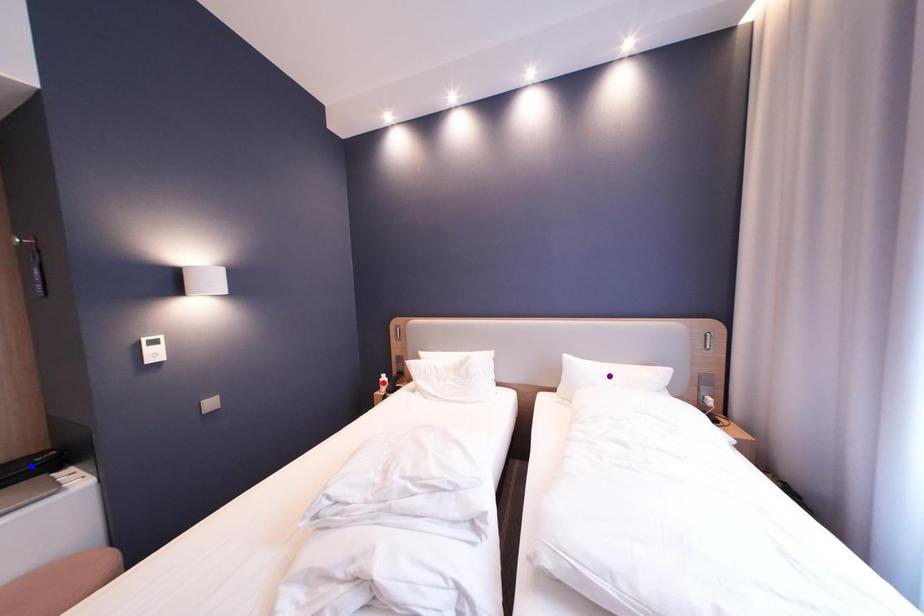
Order these from farthest to nearest:
- purple point
- blue point
- red point

red point, purple point, blue point